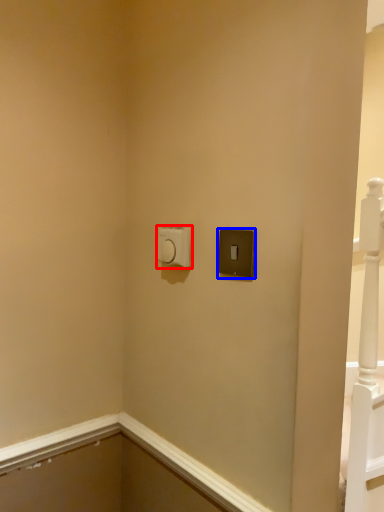
Question: Which object appears farthest to the camera in this image, light switch (highlighted by a red box) or light switch (highlighted by a blue box)?

Choices:
 (A) light switch
 (B) light switch

Answer: (A)